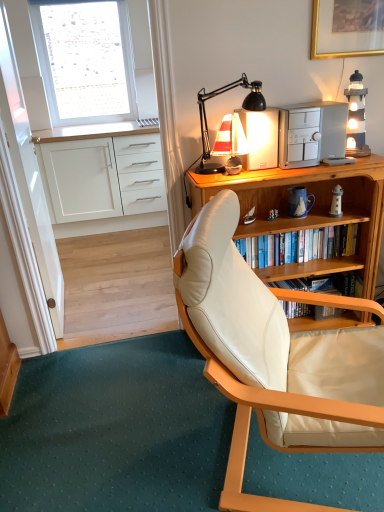
Locate an element on the screen. free spot to the left of wooden desk at center is located at coordinates (158, 374).